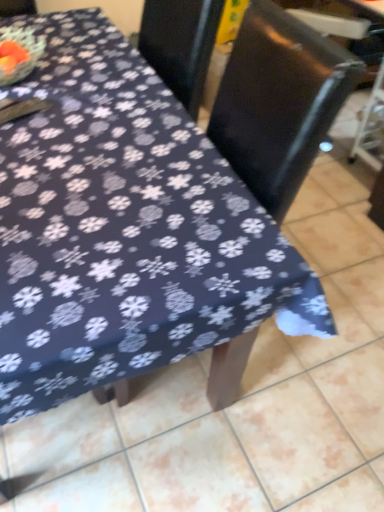
The width and height of the screenshot is (384, 512). In order to click on vacant space to the right of black glossy chair at upper center in this screenshot , I will do `click(334, 345)`.